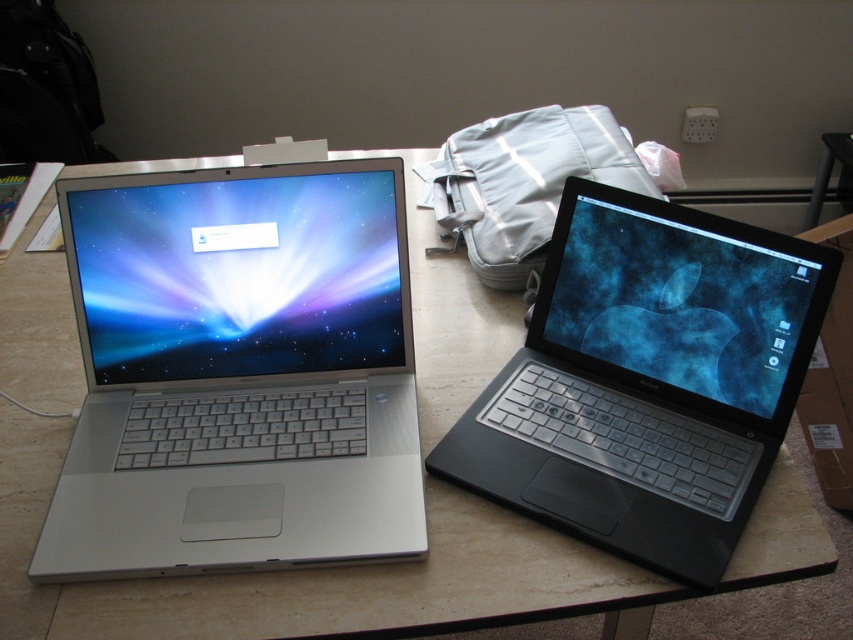
You are organizing a school event and need to determine which item takes up more space. You see a black glossy laptop at right and a matte white backpack at center. Which item requires more space due to its size?

The black glossy laptop at right has a larger size compared to the matte white backpack at center, so it requires more space.

You are organizing a tech showcase and need to arrange the silver metallic laptop at left and the black glossy laptop at right on a shelf. The shelf has limited vertical space. Based on their positions in the image, which laptop should you place first to ensure they both fit vertically?

The silver metallic laptop at left should be placed first because it is positioned above the black glossy laptop at right in the image, indicating it is taller and requires more vertical space.